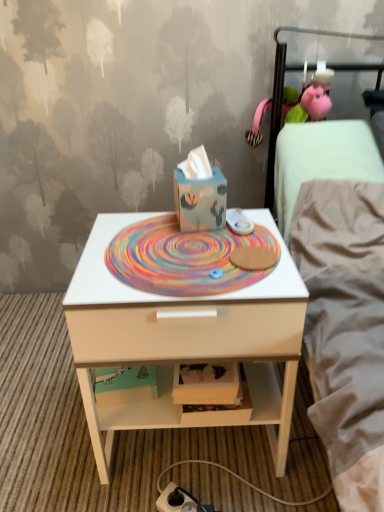
Find the location of a particular element. The image size is (384, 512). vacant area situated to the left side of white matte nightstand at center is located at coordinates (45, 418).